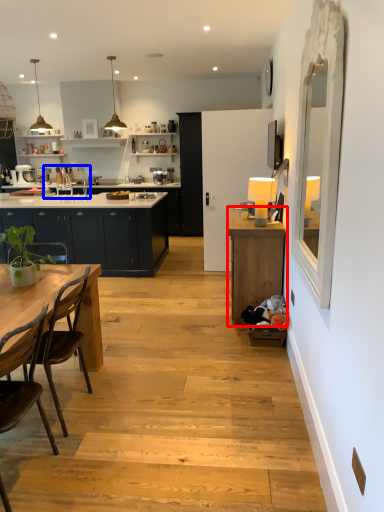
Question: Which of the following is the closest to the observer, cabinetry (highlighted by a red box) or sink (highlighted by a blue box)?

Choices:
 (A) cabinetry
 (B) sink

Answer: (A)